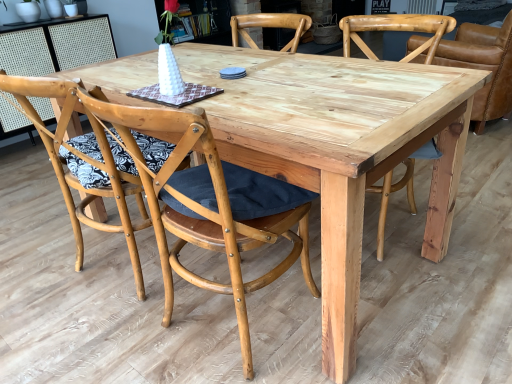
Image resolution: width=512 pixels, height=384 pixels. Find the location of `natural wood chair at center, which is the 4th chair in right-to-left order`. natural wood chair at center, which is the 4th chair in right-to-left order is located at coordinates (82, 160).

Locate an element on the screen. This screenshot has height=384, width=512. natural wood chair at center, which ranks as the first chair in left-to-right order is located at coordinates (82, 160).

Is natural wood chair at right, the first chair viewed from the right, turned away from natural wood chair at center, the 2th chair from the left?

natural wood chair at right, the first chair viewed from the right, is not turned away from natural wood chair at center, the 2th chair from the left.

How many degrees apart are the facing directions of natural wood chair at right, which is counted as the fourth chair, starting from the left, and natural wood chair at center, the 2th chair from the left?

76.2 degrees separate the facing orientations of natural wood chair at right, which is counted as the fourth chair, starting from the left, and natural wood chair at center, the 2th chair from the left.

From the natural wood chair at right, which is counted as the fourth chair, starting from the left, count 3rd chairs forward and point to it. Please provide its 2D coordinates.

[(208, 206)]

Does natural wood chair at right, the first chair viewed from the right, have a lesser height compared to natural wood chair at center, acting as the third chair starting from the right?

Indeed, natural wood chair at right, the first chair viewed from the right, has a lesser height compared to natural wood chair at center, acting as the third chair starting from the right.

Which object is wider, natural wood chair at center, marked as the third chair in a left-to-right arrangement, or natural wood chair at center, which ranks as the first chair in left-to-right order?

natural wood chair at center, marked as the third chair in a left-to-right arrangement, is wider.

Would you say natural wood chair at center, which ranks as the first chair in left-to-right order, is part of natural wood chair at center, which ranks as the second chair in right-to-left order,'s contents?

That's incorrect, natural wood chair at center, which ranks as the first chair in left-to-right order, is not inside natural wood chair at center, which ranks as the second chair in right-to-left order.

Does natural wood chair at center, marked as the third chair in a left-to-right arrangement, have a larger size compared to natural wood chair at center, which is the 4th chair in right-to-left order?

Yes.

Is natural wood chair at center, marked as the third chair in a left-to-right arrangement, positioned behind natural wood chair at center, which ranks as the first chair in left-to-right order?

Yes, natural wood chair at center, marked as the third chair in a left-to-right arrangement, is further from the viewer.

From the picture: From the image's perspective, is natural wood chair at right, which is counted as the fourth chair, starting from the left, located above or below natural wood chair at center, marked as the third chair in a left-to-right arrangement?

natural wood chair at right, which is counted as the fourth chair, starting from the left, is above natural wood chair at center, marked as the third chair in a left-to-right arrangement.

Would you say natural wood chair at right, the first chair viewed from the right, is a long distance from natural wood chair at center, marked as the third chair in a left-to-right arrangement?

No, natural wood chair at right, the first chair viewed from the right, is not far from natural wood chair at center, marked as the third chair in a left-to-right arrangement.

Is point (485, 38) positioned in front of point (423, 50)?

No, it is behind (423, 50).

From a real-world perspective, is natural wood chair at center, which ranks as the first chair in left-to-right order, located beneath natural wood chair at center, the 2th chair from the left?

No, from a real-world perspective, natural wood chair at center, which ranks as the first chair in left-to-right order, is not under natural wood chair at center, the 2th chair from the left.

Is natural wood chair at center, which is the 4th chair in right-to-left order, next to natural wood chair at center, acting as the third chair starting from the right?

There is a gap between natural wood chair at center, which is the 4th chair in right-to-left order, and natural wood chair at center, acting as the third chair starting from the right.

Is natural wood chair at center, which ranks as the first chair in left-to-right order, behind natural wood chair at center, the 2th chair from the left?

Yes, natural wood chair at center, which ranks as the first chair in left-to-right order, is behind natural wood chair at center, the 2th chair from the left.

Between natural wood chair at center, which is the 4th chair in right-to-left order, and natural wood chair at center, the 2th chair from the left, which one has larger size?

With larger size is natural wood chair at center, which is the 4th chair in right-to-left order.

In order to click on chair that appears below the natural wood chair at center, which is the 4th chair in right-to-left order (from the image's perspective) in this screenshot , I will do `click(208, 206)`.

Is natural wood chair at center, which ranks as the first chair in left-to-right order, at the back of natural wood chair at center, the 2th chair from the left?

No.

From the image's perspective, is natural wood chair at center, acting as the third chair starting from the right, located beneath natural wood chair at center, which ranks as the first chair in left-to-right order?

Indeed, from the image's perspective, natural wood chair at center, acting as the third chair starting from the right, is shown beneath natural wood chair at center, which ranks as the first chair in left-to-right order.

Image resolution: width=512 pixels, height=384 pixels. I want to click on the 2nd chair to the right when counting from the natural wood chair at center, the 2th chair from the left, so click(x=483, y=66).

Is point (276, 232) positioned behind point (485, 87)?

No, (276, 232) is in front of (485, 87).

Is natural wood chair at center, acting as the third chair starting from the right, placed right next to natural wood chair at right, which is counted as the fourth chair, starting from the left?

natural wood chair at center, acting as the third chair starting from the right, and natural wood chair at right, which is counted as the fourth chair, starting from the left, are clearly separated.

Consider the image. Considering their positions, is natural wood chair at center, the 2th chair from the left, located in front of or behind natural wood chair at right, which is counted as the fourth chair, starting from the left?

In the image, natural wood chair at center, the 2th chair from the left, appears in front of natural wood chair at right, which is counted as the fourth chair, starting from the left.

Identify the location of chair that is the 2nd object located in front of the natural wood chair at right, the first chair viewed from the right. (82, 160).

From the image's perspective, is natural wood chair at center, which is the 4th chair in right-to-left order, on top of natural wood chair at right, the first chair viewed from the right?

No, from the image's perspective, natural wood chair at center, which is the 4th chair in right-to-left order, is not over natural wood chair at right, the first chair viewed from the right.

Which of these two, natural wood chair at center, which ranks as the first chair in left-to-right order, or natural wood chair at right, which is counted as the fourth chair, starting from the left, is wider?

natural wood chair at right, which is counted as the fourth chair, starting from the left, is wider.

Is natural wood chair at center, which ranks as the first chair in left-to-right order, not inside natural wood chair at right, which is counted as the fourth chair, starting from the left?

Indeed, natural wood chair at center, which ranks as the first chair in left-to-right order, is completely outside natural wood chair at right, which is counted as the fourth chair, starting from the left.

Locate an element on the screen. The image size is (512, 384). chair that is the 3rd object located above the natural wood chair at center, the 2th chair from the left (from the image's perspective) is located at coordinates (483, 66).

Locate an element on the screen. the 1st chair below the natural wood chair at center, which ranks as the second chair in right-to-left order (from the image's perspective) is located at coordinates (82, 160).

When comparing their distances from natural wood chair at center, acting as the third chair starting from the right, does natural wood chair at center, which ranks as the first chair in left-to-right order, or natural wood chair at center, which ranks as the second chair in right-to-left order, seem closer?

Among the two, natural wood chair at center, which ranks as the first chair in left-to-right order, is located nearer to natural wood chair at center, acting as the third chair starting from the right.

From the image, which object appears to be nearer to natural wood chair at center, which ranks as the second chair in right-to-left order, natural wood chair at right, which is counted as the fourth chair, starting from the left, or natural wood chair at center, the 2th chair from the left?

Among the two, natural wood chair at center, the 2th chair from the left, is located nearer to natural wood chair at center, which ranks as the second chair in right-to-left order.

Looking at the image, which one is located closer to natural wood chair at right, which is counted as the fourth chair, starting from the left, natural wood chair at center, which is the 4th chair in right-to-left order, or natural wood chair at center, which ranks as the second chair in right-to-left order?

Among the two, natural wood chair at center, which ranks as the second chair in right-to-left order, is located nearer to natural wood chair at right, which is counted as the fourth chair, starting from the left.

Looking at the image, which one is located closer to natural wood chair at center, acting as the third chair starting from the right, natural wood chair at right, which is counted as the fourth chair, starting from the left, or natural wood chair at center, marked as the third chair in a left-to-right arrangement?

Among the two, natural wood chair at center, marked as the third chair in a left-to-right arrangement, is located nearer to natural wood chair at center, acting as the third chair starting from the right.

Which object lies further to the anchor point natural wood chair at right, which is counted as the fourth chair, starting from the left, natural wood chair at center, which ranks as the second chair in right-to-left order, or natural wood chair at center, which is the 4th chair in right-to-left order?

Based on the image, natural wood chair at center, which is the 4th chair in right-to-left order, appears to be further to natural wood chair at right, which is counted as the fourth chair, starting from the left.

Based on their spatial positions, is natural wood chair at center, which ranks as the second chair in right-to-left order, or natural wood chair at right, the first chair viewed from the right, closer to natural wood chair at center, the 2th chair from the left?

natural wood chair at center, which ranks as the second chair in right-to-left order, is closer to natural wood chair at center, the 2th chair from the left.

Considering their positions, is natural wood chair at center, marked as the third chair in a left-to-right arrangement, positioned further to natural wood chair at right, the first chair viewed from the right, than natural wood chair at center, acting as the third chair starting from the right?

natural wood chair at center, acting as the third chair starting from the right.

Which object lies further to the anchor point natural wood chair at center, the 2th chair from the left, natural wood chair at center, which ranks as the first chair in left-to-right order, or natural wood chair at right, the first chair viewed from the right?

The object further to natural wood chair at center, the 2th chair from the left, is natural wood chair at right, the first chair viewed from the right.

You are a GUI agent. You are given a task and a screenshot of the screen. Output one action in this format:
    pyautogui.click(x=<x>, y=<y>)
    Task: Click on the chair situated between natural wood chair at center, the 2th chair from the left, and natural wood chair at right, the first chair viewed from the right, from left to right
    This screenshot has height=384, width=512.
    Given the screenshot: What is the action you would take?
    pyautogui.click(x=396, y=30)

This screenshot has width=512, height=384. What are the coordinates of `chair between natural wood chair at center, which is the 4th chair in right-to-left order, and natural wood chair at center, marked as the third chair in a left-to-right arrangement, in the horizontal direction` in the screenshot? It's located at (208, 206).